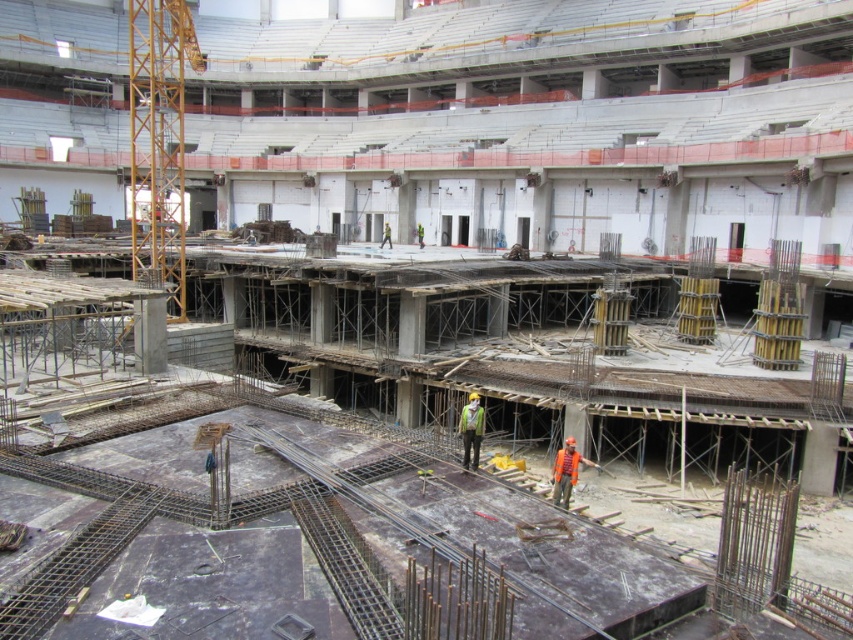
Who is lower down, yellow metallic crane at left or green reflective safety vest at center?

Positioned lower is green reflective safety vest at center.

Which is behind, point (135, 252) or point (467, 461)?

The point (135, 252) is behind.

Between point (167, 74) and point (465, 417), which one is positioned in front?

Point (465, 417) is more forward.

Find the location of a particular element. Image resolution: width=853 pixels, height=640 pixels. yellow metallic crane at left is located at coordinates (160, 140).

Can you confirm if yellow metallic crane at left is smaller than orange reflective vest at center?

No, yellow metallic crane at left is not smaller than orange reflective vest at center.

Between yellow metallic crane at left and orange reflective vest at center, which one is positioned lower?

Positioned lower is orange reflective vest at center.

Which is behind, point (171, 97) or point (584, 460)?

Point (171, 97)

Locate an element on the screen. The width and height of the screenshot is (853, 640). yellow metallic crane at left is located at coordinates (160, 140).

Can you confirm if orange reflective vest at center is wider than green reflective safety vest at center?

Yes, orange reflective vest at center is wider than green reflective safety vest at center.

Between orange reflective vest at center and green reflective safety vest at center, which one has less height?

Standing shorter between the two is orange reflective vest at center.

Is point (573, 440) positioned behind point (476, 461)?

Yes, point (573, 440) is behind point (476, 461).

This screenshot has width=853, height=640. Identify the location of orange reflective vest at center. (566, 472).